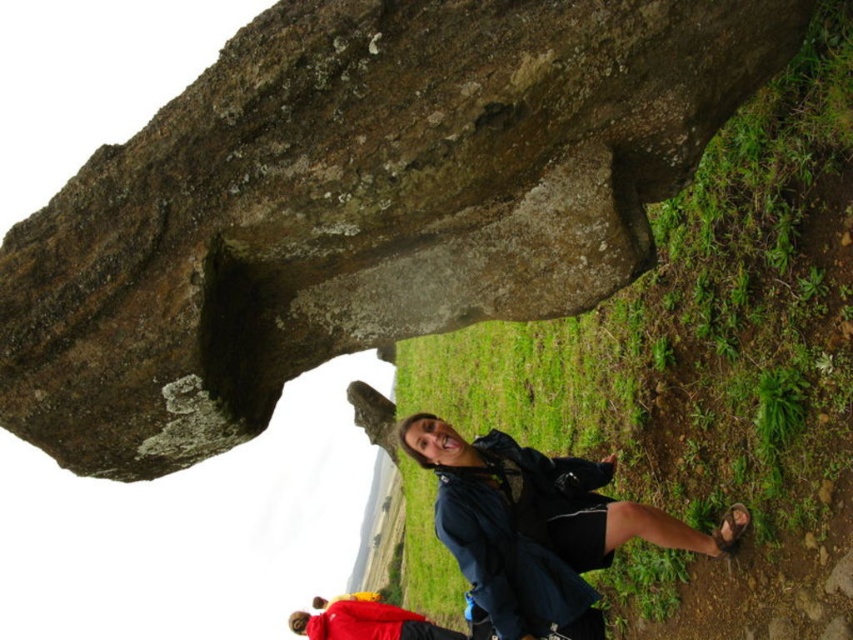
Between rough stone boulder at upper center and matte blue jacket at lower right, which one is positioned higher?

rough stone boulder at upper center is above.

Based on the photo, does rough stone boulder at upper center have a greater width compared to matte blue jacket at lower right?

Correct, the width of rough stone boulder at upper center exceeds that of matte blue jacket at lower right.

This screenshot has height=640, width=853. What do you see at coordinates (357, 204) in the screenshot?
I see `rough stone boulder at upper center` at bounding box center [357, 204].

Image resolution: width=853 pixels, height=640 pixels. What are the coordinates of `rough stone boulder at upper center` in the screenshot? It's located at (357, 204).